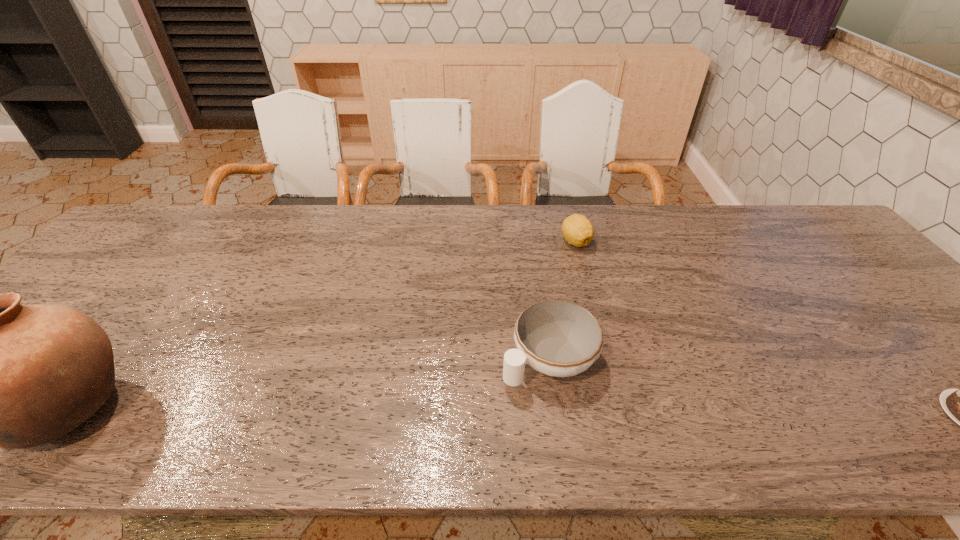
You are a GUI agent. You are given a task and a screenshot of the screen. Output one action in this format:
    pyautogui.click(x=<x>, y=<y>)
    Task: Click on the free space on the desktop that is between the tallest object and the shortest object and is positioned on the side with the handle of the third shortest object
    
    Given the screenshot: What is the action you would take?
    pyautogui.click(x=467, y=412)

The image size is (960, 540). Find the location of `vacant space on the desktop that is between the leftmost object and the rightmost object and is positioned at the stem end of the lemon`. vacant space on the desktop that is between the leftmost object and the rightmost object and is positioned at the stem end of the lemon is located at coordinates (599, 414).